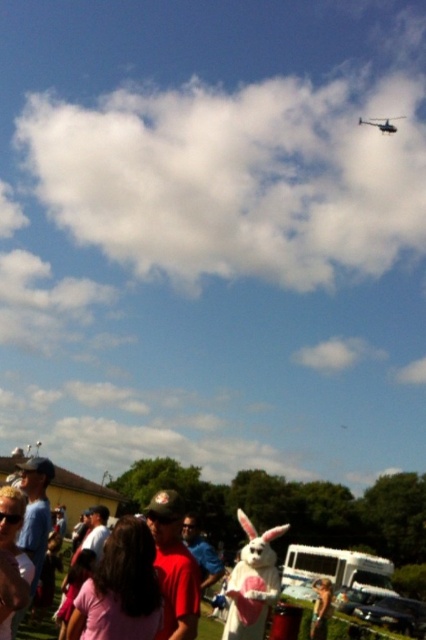
Between white plush rabbit at center and metallic silver helicopter at upper right, which one is positioned higher?

metallic silver helicopter at upper right is above.

Does white plush rabbit at center appear over metallic silver helicopter at upper right?

No, white plush rabbit at center is not above metallic silver helicopter at upper right.

Is point (247, 522) closer to viewer compared to point (379, 129)?

Yes, it is in front of point (379, 129).

This screenshot has width=426, height=640. In order to click on white plush rabbit at center in this screenshot , I will do pos(252,582).